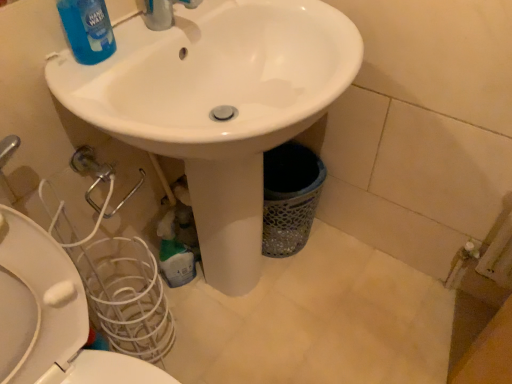
Question: Considering the relative sizes of blue glossy liquid at upper left, which ranks as the 1th cleaning product in top-to-bottom order, and green plastic bottle at lower center, placed as the 2th cleaning product when sorted from top to bottom, in the image provided, is blue glossy liquid at upper left, which ranks as the 1th cleaning product in top-to-bottom order, thinner than green plastic bottle at lower center, placed as the 2th cleaning product when sorted from top to bottom,?

Choices:
 (A) no
 (B) yes

Answer: (B)

Question: Considering the relative sizes of blue glossy liquid at upper left, the second cleaning product when ordered from back to front, and green plastic bottle at lower center, placed as the 2th cleaning product when sorted from top to bottom, in the image provided, is blue glossy liquid at upper left, the second cleaning product when ordered from back to front, bigger than green plastic bottle at lower center, placed as the 2th cleaning product when sorted from top to bottom,?

Choices:
 (A) no
 (B) yes

Answer: (A)

Question: Is green plastic bottle at lower center, the first cleaning product from the bottom, located within blue glossy liquid at upper left, which ranks as the 1th cleaning product in top-to-bottom order?

Choices:
 (A) yes
 (B) no

Answer: (B)

Question: Is blue glossy liquid at upper left, the first cleaning product in the front-to-back sequence, turned away from green plastic bottle at lower center, the 2th cleaning product viewed from the front?

Choices:
 (A) yes
 (B) no

Answer: (B)

Question: Considering the relative positions of blue glossy liquid at upper left, the second cleaning product when ordered from back to front, and green plastic bottle at lower center, the 2th cleaning product viewed from the front, in the image provided, is blue glossy liquid at upper left, the second cleaning product when ordered from back to front, behind green plastic bottle at lower center, the 2th cleaning product viewed from the front,?

Choices:
 (A) yes
 (B) no

Answer: (B)

Question: Considering the positions of point (228, 167) and point (95, 16), is point (228, 167) closer or farther from the camera than point (95, 16)?

Choices:
 (A) closer
 (B) farther

Answer: (B)

Question: Is white glossy sink at center inside or outside of blue glossy liquid at upper left, which ranks as the 1th cleaning product in top-to-bottom order?

Choices:
 (A) inside
 (B) outside

Answer: (B)

Question: From a real-world perspective, relative to blue glossy liquid at upper left, which ranks as the 2th cleaning product in bottom-to-top order, is white glossy sink at center vertically above or below?

Choices:
 (A) below
 (B) above

Answer: (A)

Question: Considering the positions of white glossy sink at center and blue glossy liquid at upper left, the first cleaning product in the front-to-back sequence, in the image, is white glossy sink at center wider or thinner than blue glossy liquid at upper left, the first cleaning product in the front-to-back sequence,?

Choices:
 (A) thin
 (B) wide

Answer: (B)

Question: Considering the positions of point (78, 6) and point (143, 127), is point (78, 6) closer or farther from the camera than point (143, 127)?

Choices:
 (A) closer
 (B) farther

Answer: (B)

Question: Looking at their shapes, would you say blue glossy liquid at upper left, the first cleaning product in the front-to-back sequence, is wider or thinner than white glossy sink at center?

Choices:
 (A) wide
 (B) thin

Answer: (B)

Question: Would you say blue glossy liquid at upper left, the second cleaning product when ordered from back to front, is inside or outside white glossy sink at center?

Choices:
 (A) inside
 (B) outside

Answer: (A)

Question: Considering their positions, is blue glossy liquid at upper left, the second cleaning product when ordered from back to front, located in front of or behind white glossy sink at center?

Choices:
 (A) front
 (B) behind

Answer: (B)

Question: Is white glossy toilet at lower left spatially inside blue glossy liquid at upper left, the first cleaning product in the front-to-back sequence, or outside of it?

Choices:
 (A) inside
 (B) outside

Answer: (B)

Question: Considering the positions of white glossy toilet at lower left and blue glossy liquid at upper left, which ranks as the 2th cleaning product in bottom-to-top order, in the image, is white glossy toilet at lower left bigger or smaller than blue glossy liquid at upper left, which ranks as the 2th cleaning product in bottom-to-top order,?

Choices:
 (A) small
 (B) big

Answer: (B)